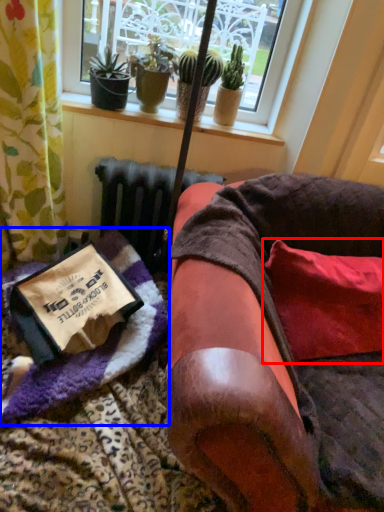
Question: Which object appears farthest to the camera in this image, pillow (highlighted by a red box) or blanket (highlighted by a blue box)?

Choices:
 (A) pillow
 (B) blanket

Answer: (A)